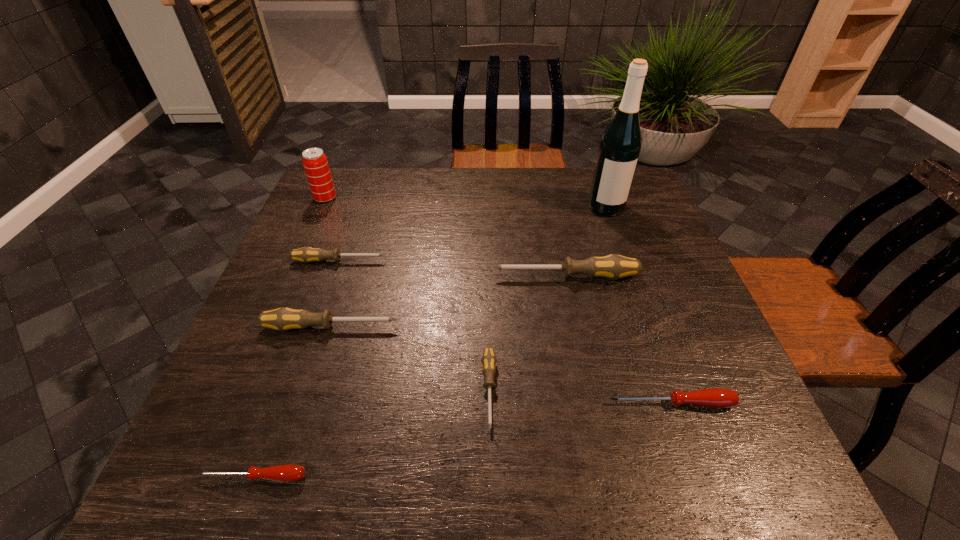
At what (x,y) coordinates should I click in order to perform the action: click on object at the far right corner. Please return your answer as a coordinate pair (x, y). The image size is (960, 540). Looking at the image, I should click on (620, 146).

At what (x,y) coordinates should I click in order to perform the action: click on vacant area at the far edge of the desktop. Please return your answer as a coordinate pair (x, y). This screenshot has height=540, width=960. Looking at the image, I should click on (457, 205).

Where is `vacant space at the near edge`? This screenshot has width=960, height=540. vacant space at the near edge is located at coordinates (420, 461).

This screenshot has height=540, width=960. I want to click on vacant position at the left edge of the desktop, so click(x=262, y=401).

Find the location of a particular element. The width and height of the screenshot is (960, 540). free region at the right edge of the desktop is located at coordinates (674, 372).

Locate an element on the screen. This screenshot has width=960, height=540. free space at the far left corner is located at coordinates (352, 181).

In the image, there is a desktop. Identify the location of vacant space at the near right corner. This screenshot has height=540, width=960. (772, 448).

I want to click on free space between the farthest gray screwdriver and the tallest object, so click(x=472, y=234).

This screenshot has height=540, width=960. What are the coordinates of `vacant area that lies between the tallest object and the nearest object` in the screenshot? It's located at (430, 342).

I want to click on free spot between the soda can and the nearest screwdriver, so click(x=289, y=338).